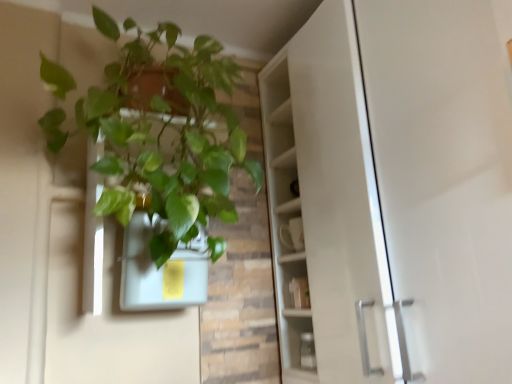
Question: In terms of size, does green matte plant at upper left appear bigger or smaller than matte white flowerpot at upper left?

Choices:
 (A) big
 (B) small

Answer: (A)

Question: Is green matte plant at upper left taller or shorter than matte white flowerpot at upper left?

Choices:
 (A) short
 (B) tall

Answer: (B)

Question: Considering the positions of green matte plant at upper left and matte white flowerpot at upper left in the image, is green matte plant at upper left wider or thinner than matte white flowerpot at upper left?

Choices:
 (A) thin
 (B) wide

Answer: (B)

Question: In terms of width, does matte white flowerpot at upper left look wider or thinner when compared to green matte plant at upper left?

Choices:
 (A) thin
 (B) wide

Answer: (A)

Question: Looking at the image, does matte white flowerpot at upper left seem bigger or smaller compared to green matte plant at upper left?

Choices:
 (A) big
 (B) small

Answer: (B)

Question: Is matte white flowerpot at upper left taller or shorter than green matte plant at upper left?

Choices:
 (A) short
 (B) tall

Answer: (A)

Question: Would you say matte white flowerpot at upper left is inside or outside green matte plant at upper left?

Choices:
 (A) outside
 (B) inside

Answer: (B)